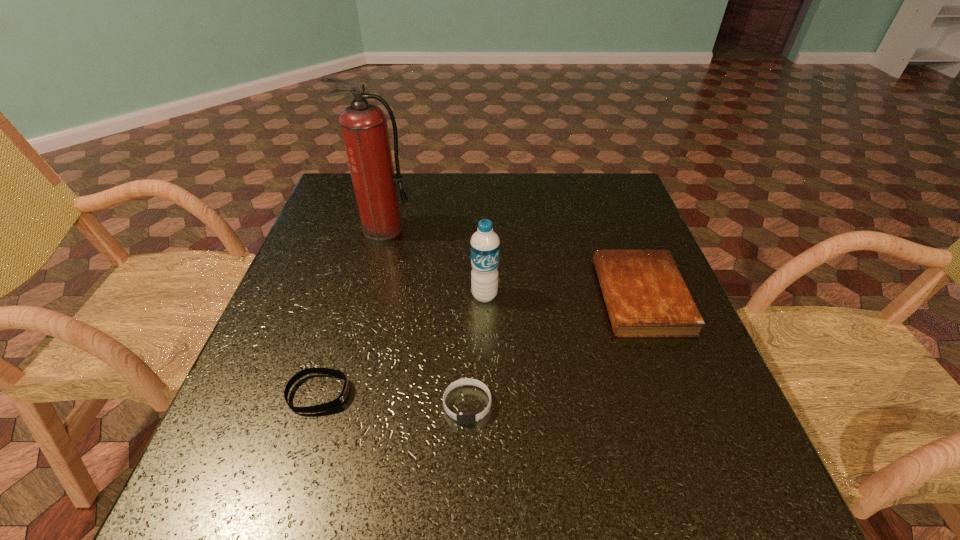
Locate an element on the screen. free space between the Bible and the water bottle is located at coordinates (563, 296).

The image size is (960, 540). I want to click on vacant space that's between the water bottle and the left wristband, so click(402, 345).

Locate an element on the screen. The height and width of the screenshot is (540, 960). free space between the Bible and the shortest object is located at coordinates (480, 345).

Find the location of `empty space that is in between the fire extinguisher and the left wristband`. empty space that is in between the fire extinguisher and the left wristband is located at coordinates (351, 312).

At what (x,y) coordinates should I click in order to perform the action: click on object that is the nearest to the left wristband. Please return your answer as a coordinate pair (x, y). Looking at the image, I should click on (463, 418).

Identify which object is located as the second nearest to the shorter wristband. Please provide its 2D coordinates. Your answer should be formatted as a tuple, i.e. [(x, y)], where the tuple contains the x and y coordinates of a point satisfying the conditions above.

[(484, 245)]

This screenshot has width=960, height=540. What are the coordinates of `vacant space that satisfies the following two spatial constraints: 1. at the nozzle of the farthest object; 2. on the display of the left wristband` in the screenshot? It's located at [340, 394].

Image resolution: width=960 pixels, height=540 pixels. What are the coordinates of `free space that satisfies the following two spatial constraints: 1. at the nozzle of the tallest object; 2. on the display of the shortest object` in the screenshot? It's located at (340, 394).